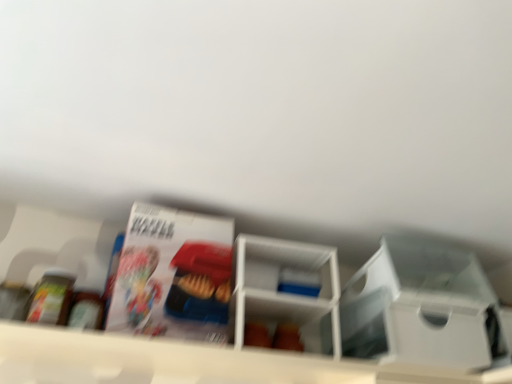
Question: In terms of height, does white glossy magazine at upper center look taller or shorter compared to white plastic shelf at center, the second shelf from the right?

Choices:
 (A) short
 (B) tall

Answer: (B)

Question: Considering the relative positions of white glossy magazine at upper center and white plastic shelf at center, the second shelf from the right, in the image provided, is white glossy magazine at upper center to the left or to the right of white plastic shelf at center, the second shelf from the right,?

Choices:
 (A) left
 (B) right

Answer: (A)

Question: Based on their relative distances, which object is nearer to the white plastic shelf at center, which is counted as the first shelf, starting from the right?

Choices:
 (A) white glossy magazine at upper center
 (B) white plastic storage box at center-right
 (C) white plastic shelf at center, placed as the first shelf when sorted from left to right

Answer: (A)

Question: Estimate the real-world distances between objects in this image. Which object is closer to the white plastic shelf at center, the second shelf from the right?

Choices:
 (A) white plastic shelf at center, which is counted as the first shelf, starting from the right
 (B) white glossy magazine at upper center
 (C) white plastic storage box at center-right

Answer: (B)